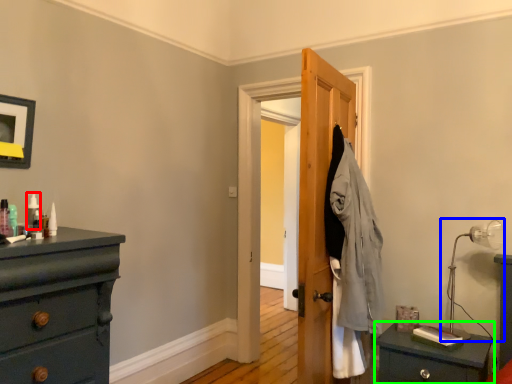
Question: Based on their relative distances, which object is nearer to toiletry (highlighted by a red box)? Choose from table lamp (highlighted by a blue box) and nightstand (highlighted by a green box).

Choices:
 (A) table lamp
 (B) nightstand

Answer: (B)